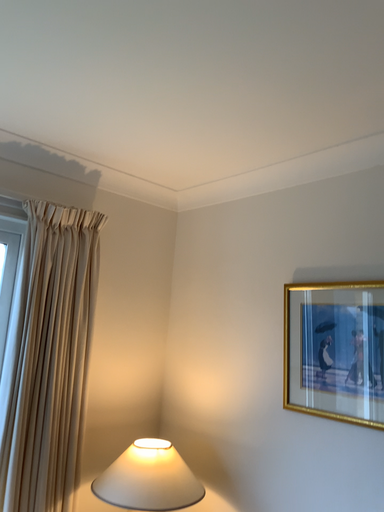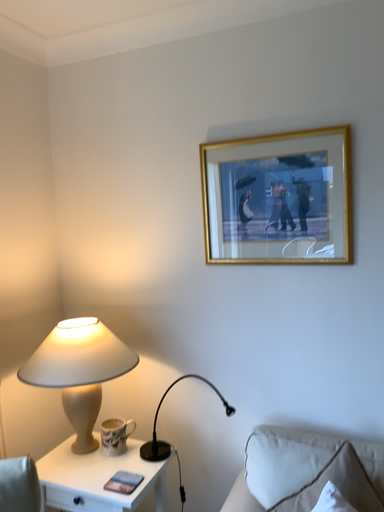
Question: How did the camera likely rotate when shooting the video?

Choices:
 (A) rotated right
 (B) rotated left

Answer: (A)